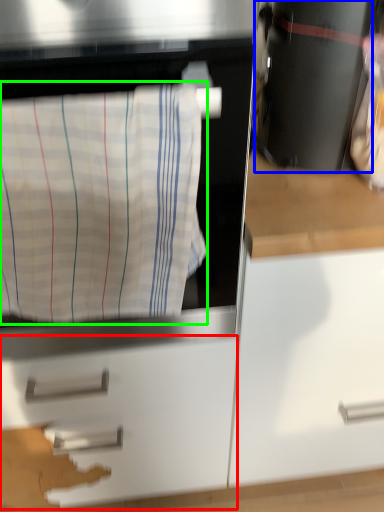
Question: Which object is the closest to the drawer (highlighted by a red box)? Choose among these: appliance (highlighted by a blue box) or laundry (highlighted by a green box).

Choices:
 (A) appliance
 (B) laundry

Answer: (B)